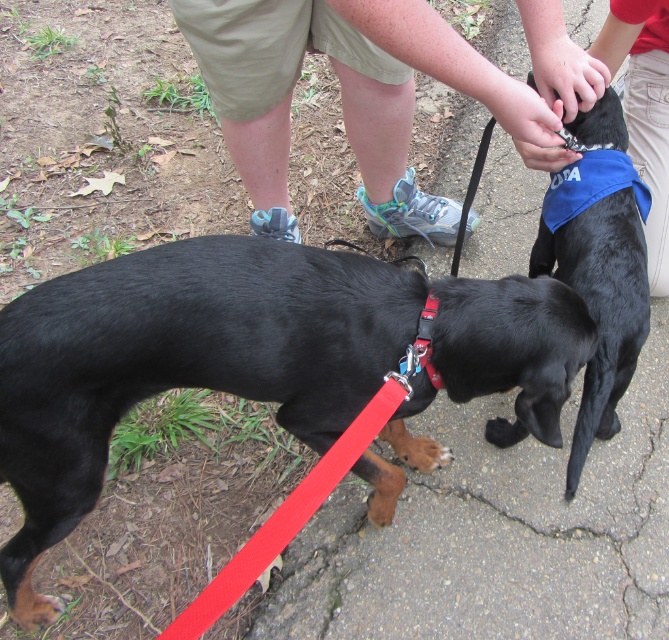
You are a photographer trying to capture both dogs in a single shot. The first dog is at point (x=339, y=26) and the second dog is at point (x=622, y=180). Based on their positions, which dog is closer to the camera?

Point (x=622, y=180) is closer to the camera than point (x=339, y=26) because the description states that point (x=339, y=26) is behind point (x=622, y=180).

You are standing in front of the image and see two points marked on it. Which point is closer to you, point (531, 145) or point (603, 179)?

Point (531, 145) is closer to the viewer than point (603, 179).